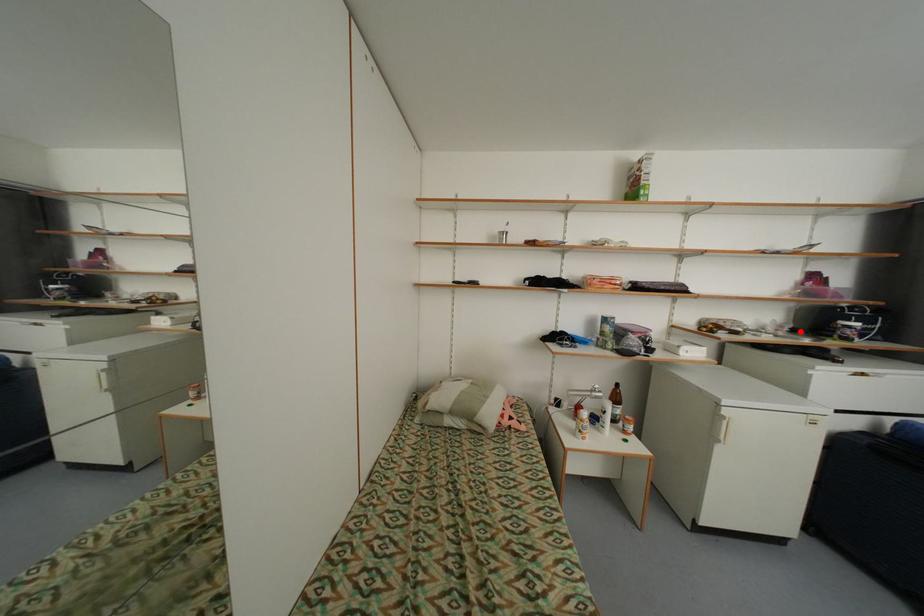
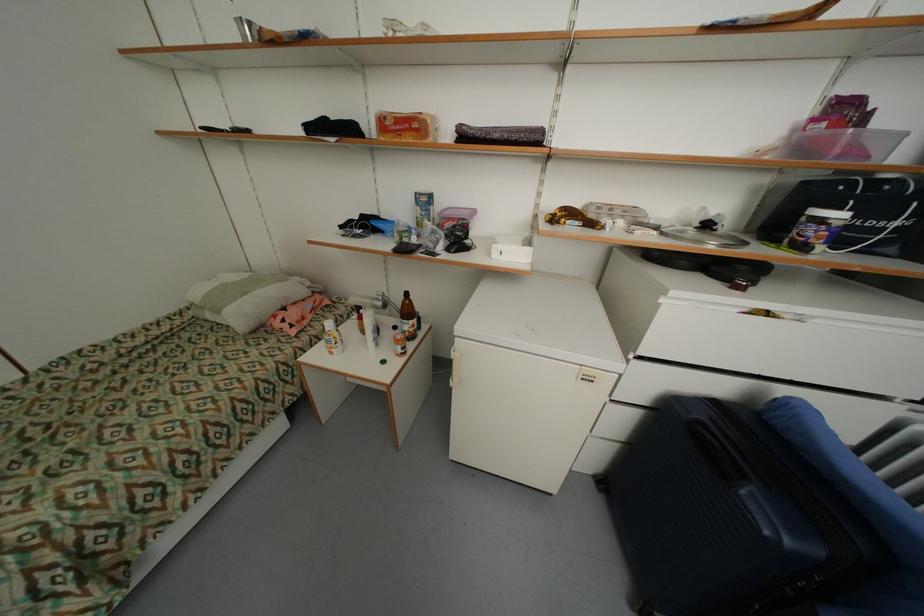
Where in the second image is the point corresponding to the highlighted location from the first image?

(713, 227)